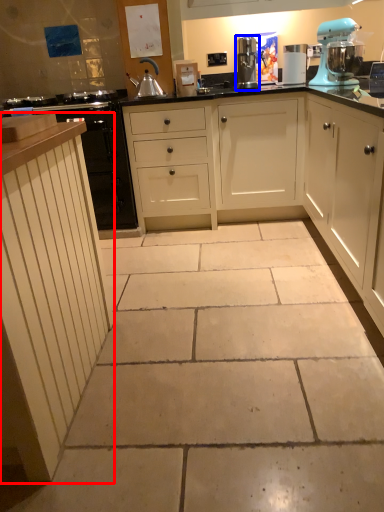
Question: Which of the following is the farthest to the observer, cabinetry (highlighted by a red box) or kitchen appliance (highlighted by a blue box)?

Choices:
 (A) cabinetry
 (B) kitchen appliance

Answer: (B)